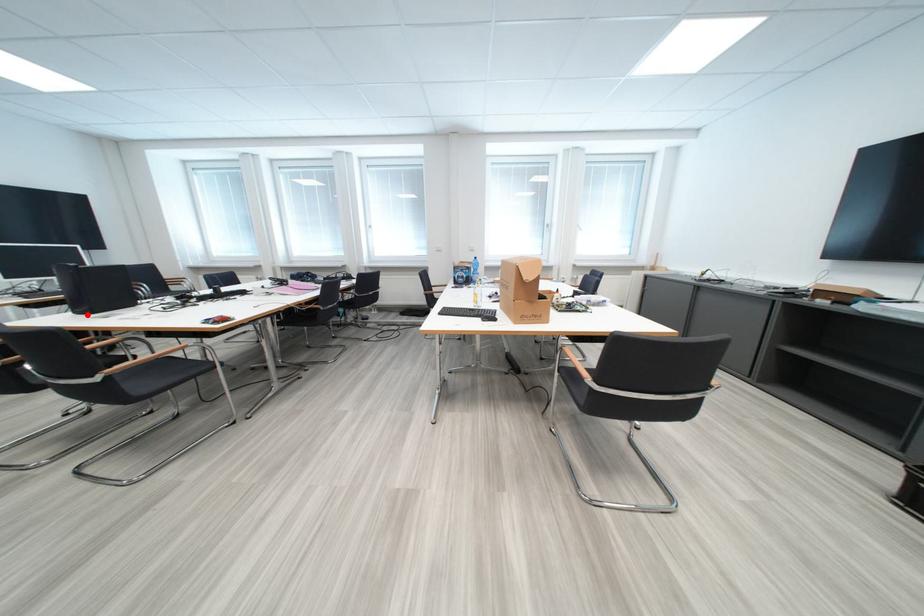
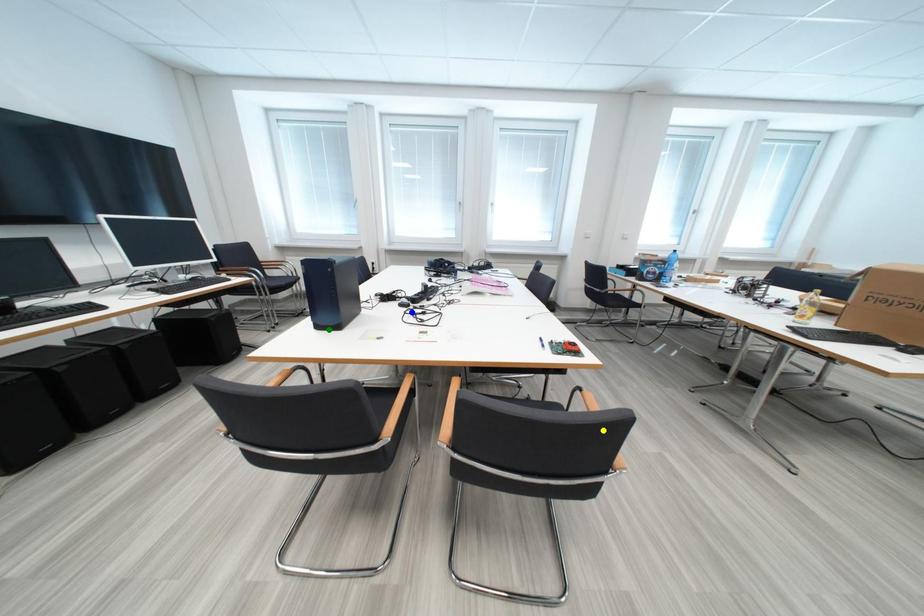
Question: I am providing you with two images of the same scene from different viewpoints. A red point is marked on the first image. You are given multiple points on the second image. Which spot in image 2 lines up with the point in image 1?

Choices:
 (A) blue point
 (B) yellow point
 (C) green point

Answer: (C)